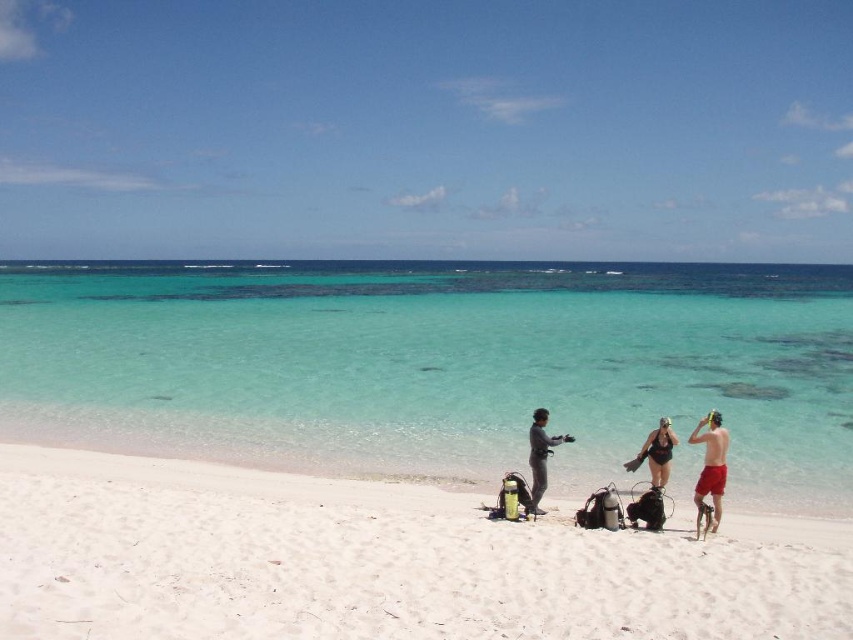
You are a photographer trying to capture the scene of the white sandy beach at center and the black matte swimsuit at center. From your position, which object is positioned to the left?

The white sandy beach at center is to the left of the black matte swimsuit at center, so the white sandy beach at center is positioned to the left.